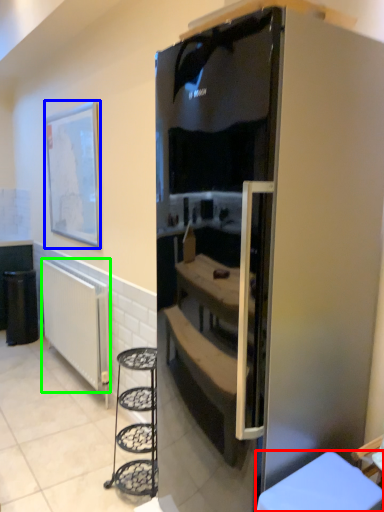
Question: Based on their relative distances, which object is farther from furniture (highlighted by a red box)? Choose from picture frame (highlighted by a blue box) and radiator (highlighted by a green box).

Choices:
 (A) picture frame
 (B) radiator

Answer: (A)